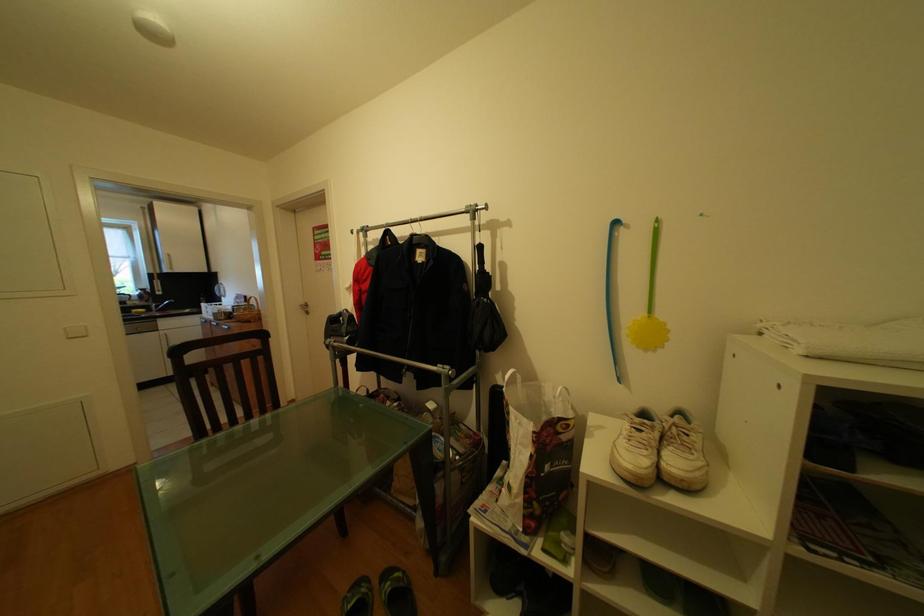
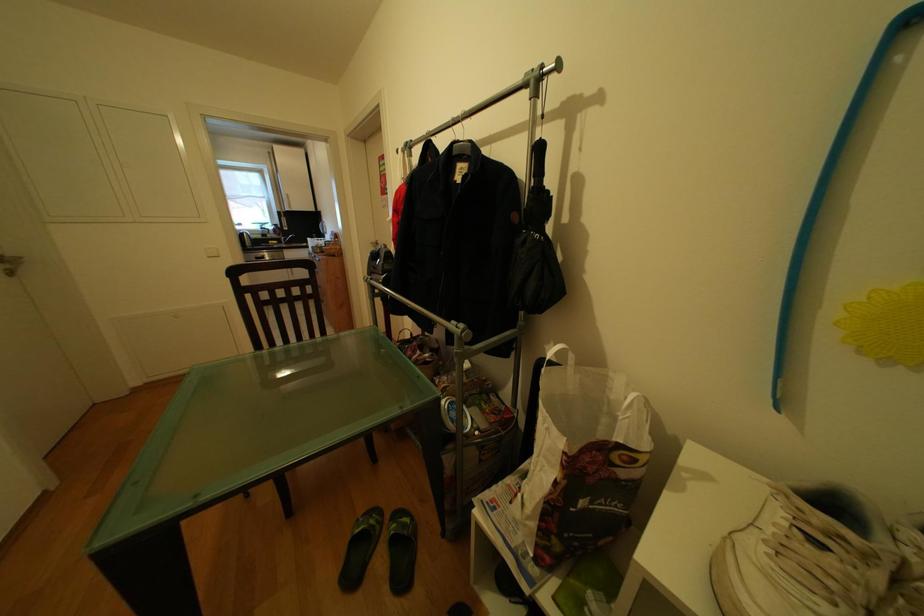
In a continuous first-person perspective shot, in which direction is the camera moving?

The cameraman moved toward right, forward.